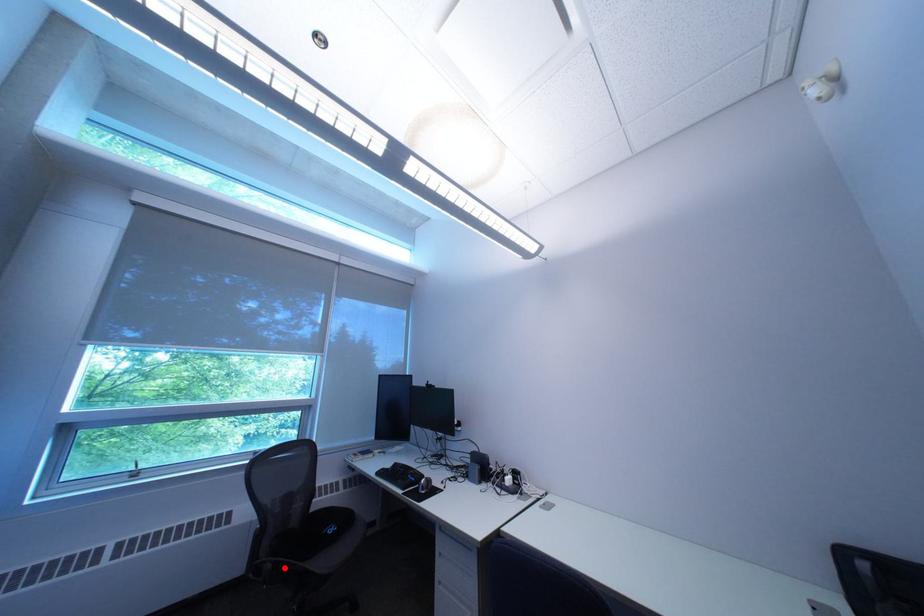
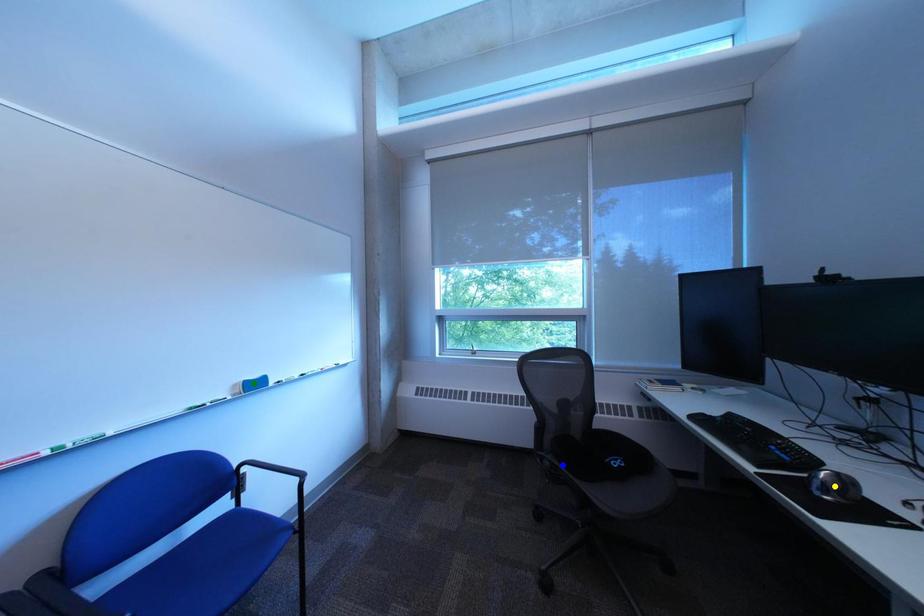
Question: I am providing you with two images of the same scene from different viewpoints. A red point is marked on the first image. You are given multiple points on the second image. Which mark in image 2 goes with the point in image 1?

Choices:
 (A) yellow point
 (B) blue point
 (C) green point

Answer: (B)